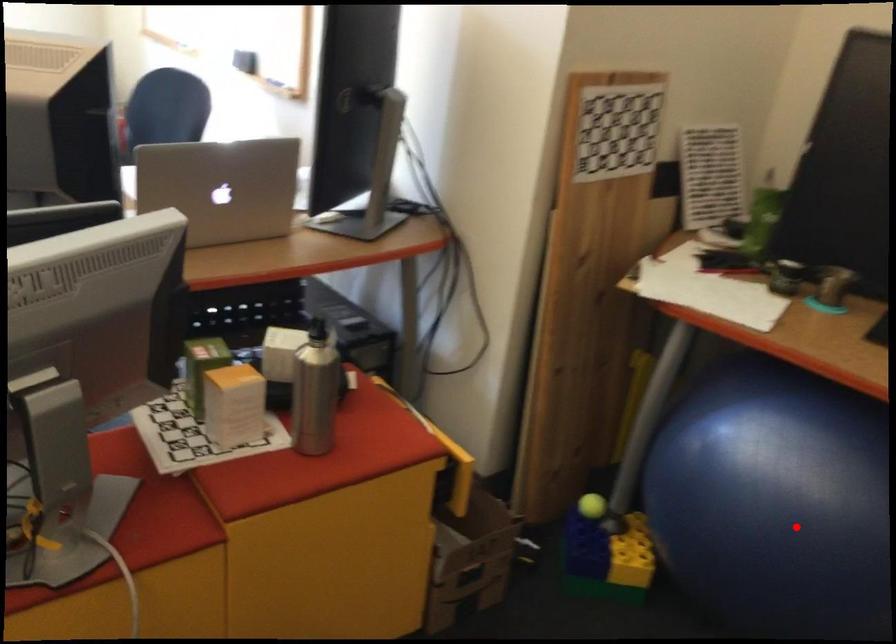
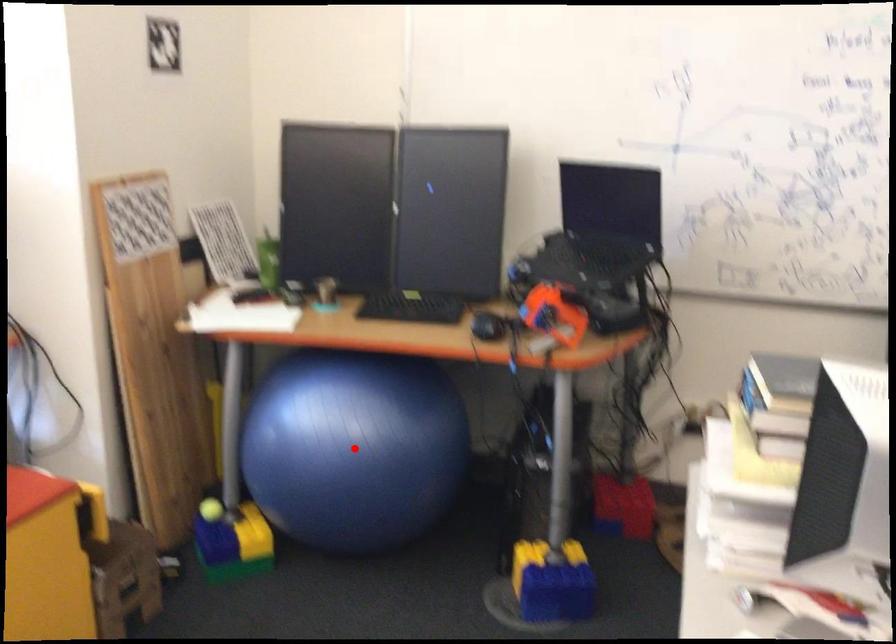
I am providing you with two images of the same scene from different viewpoints. A red point is marked on the first image and another point is marked on the second image. Does the point marked in image1 correspond to the same location as the one in image2?

Yes